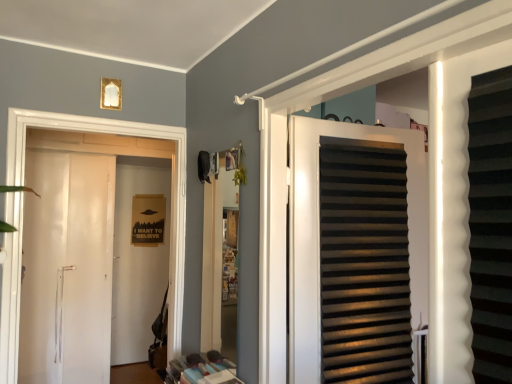
Question: Is matte black slats at center, which is the 1th door from front to back, wider or thinner than white glossy door at left, which is counted as the 2th door, starting from the right?

Choices:
 (A) thin
 (B) wide

Answer: (A)

Question: Does point (345, 125) appear closer or farther from the camera than point (174, 127)?

Choices:
 (A) farther
 (B) closer

Answer: (B)

Question: From the image's perspective, is matte black slats at center, which appears as the second door when viewed from the back, above or below white glossy door at left, which is the 2th door from front to back?

Choices:
 (A) below
 (B) above

Answer: (B)

Question: From the image's perspective, is white glossy door at left, placed as the 1th door when sorted from back to front, positioned above or below matte black slats at center, marked as the first door in a right-to-left arrangement?

Choices:
 (A) below
 (B) above

Answer: (A)

Question: Considering their positions, is white glossy door at left, which is counted as the 2th door, starting from the right, located in front of or behind matte black slats at center, the second door when ordered from left to right?

Choices:
 (A) front
 (B) behind

Answer: (B)

Question: From their relative heights in the image, would you say white glossy door at left, which is the 2th door from front to back, is taller or shorter than matte black slats at center, marked as the first door in a right-to-left arrangement?

Choices:
 (A) short
 (B) tall

Answer: (B)

Question: From a real-world perspective, is white glossy door at left, which is the 2th door from front to back, positioned above or below matte black slats at center, marked as the first door in a right-to-left arrangement?

Choices:
 (A) above
 (B) below

Answer: (B)